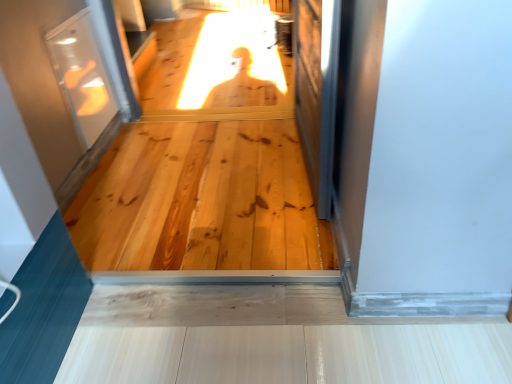
Question: From the image's perspective, relative to clear glass screen door at upper left, the 1th screen door when ordered from left to right, is transparent glass screen door at right, the first screen door from the right, above or below?

Choices:
 (A) above
 (B) below

Answer: (B)

Question: In the image, is transparent glass screen door at right, the second screen door viewed from the left, positioned in front of or behind clear glass screen door at upper left, the second screen door viewed from the right?

Choices:
 (A) behind
 (B) front

Answer: (B)

Question: Estimate the real-world distances between objects in this image. Which object is farther from the clear glass screen door at upper left, the second screen door viewed from the right?

Choices:
 (A) natural wood flooring at center
 (B) transparent glass screen door at right, the first screen door from the right

Answer: (B)

Question: Which object is positioned farthest from the natural wood flooring at center?

Choices:
 (A) transparent glass screen door at right, the second screen door viewed from the left
 (B) clear glass screen door at upper left, the 1th screen door when ordered from left to right

Answer: (B)